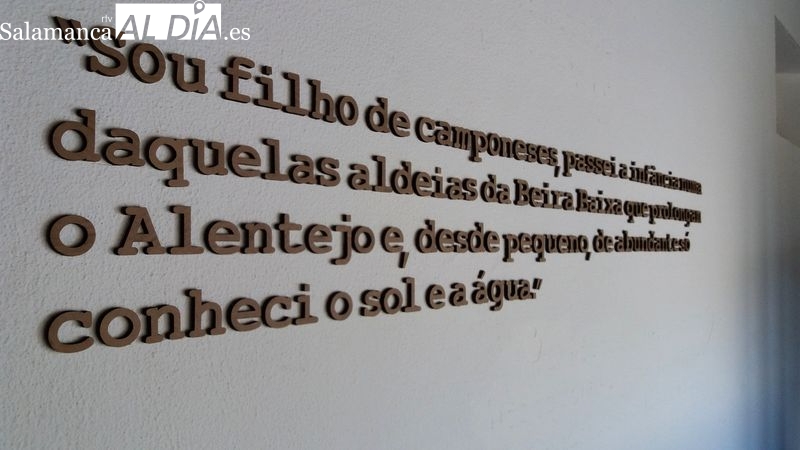
The image size is (800, 450). What are the coordinates of `hollowed out portion of wall` in the screenshot? It's located at (788, 70).